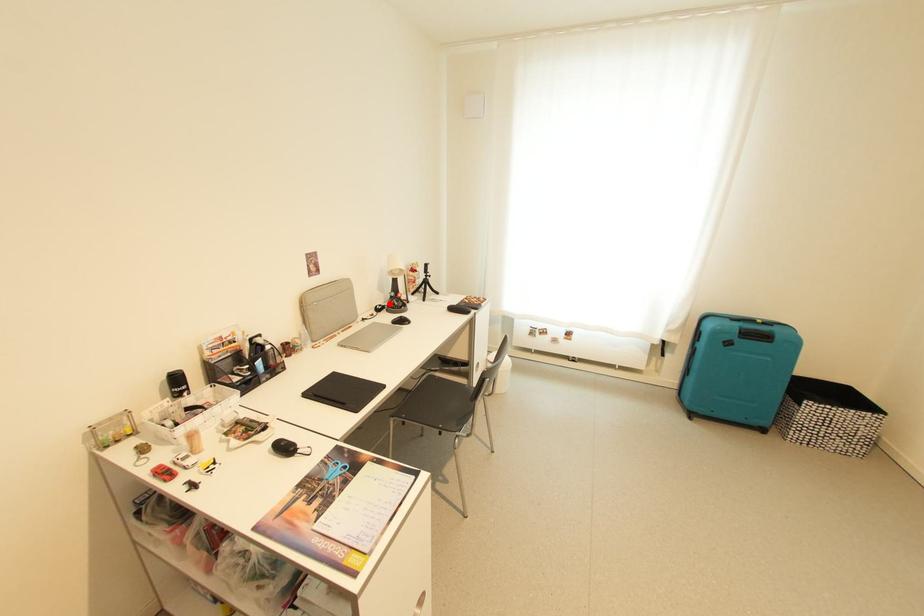
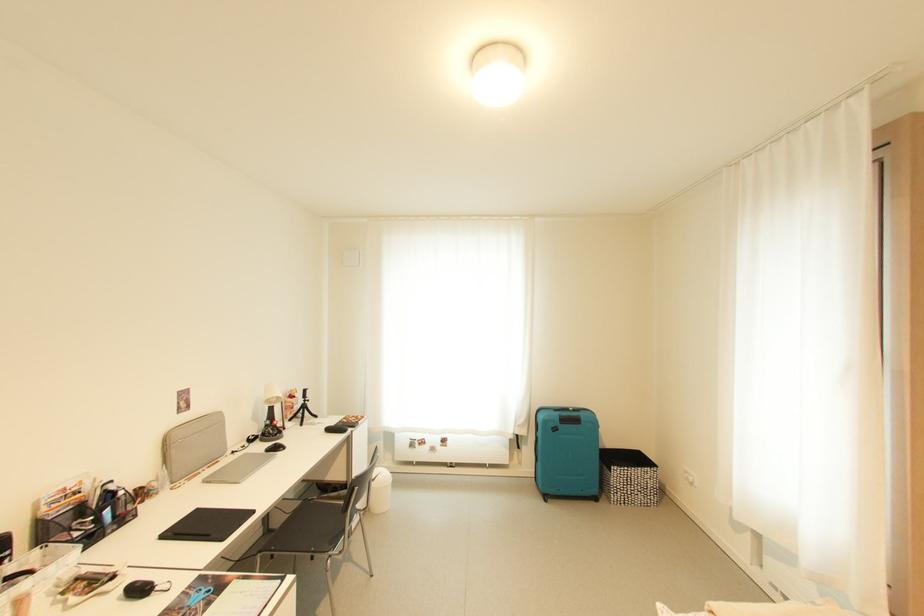
Locate, in the second image, the point that corresponds to the highlighted location in the first image.

(262, 434)